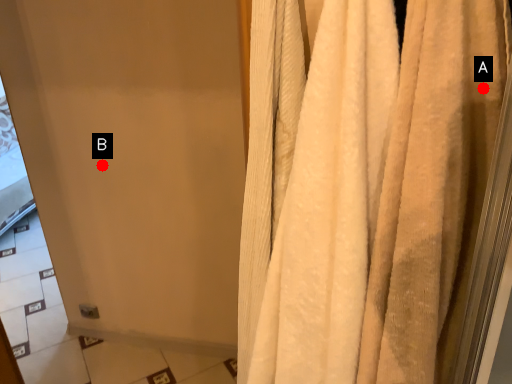
Question: Two points are circled on the image, labeled by A and B beside each circle. Among these points, which one is farthest from the camera?

Choices:
 (A) A is further
 (B) B is further

Answer: (B)